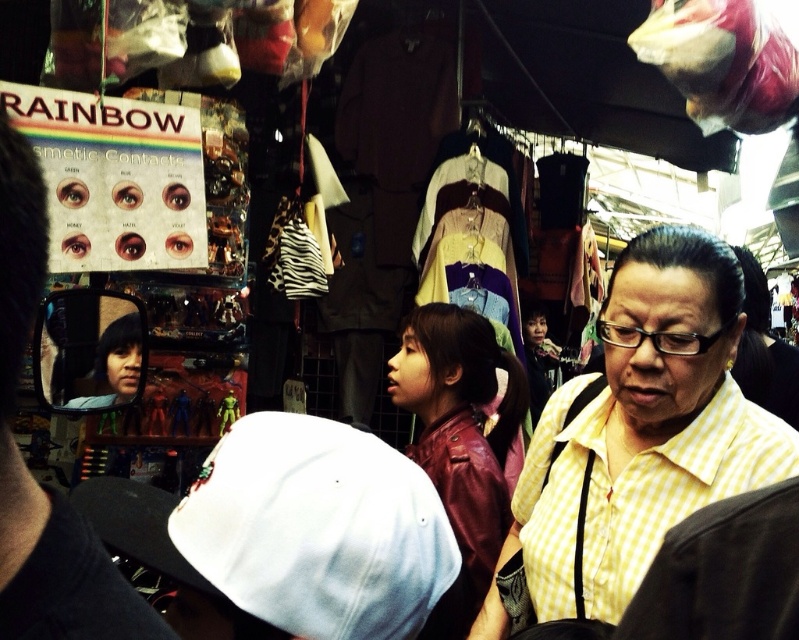
Based on the photo, you are a customer in the market and want to pick up both the yellow checkered shirt at center and the matte black cap at lower left. If you can only carry items within a 1 meter reach, will you be able to pick them up without moving your position?

The yellow checkered shirt at center and the matte black cap at lower left are 1.05 meters apart, which is slightly more than 1 meter. Therefore, you cannot pick them up without moving your position.

You are a customer at the market trying to decide between two items. You see the yellow checkered shirt at center and the matte black cap at lower left. Which item takes up more horizontal space?

The yellow checkered shirt at center might be wider than matte black cap at lower left, so it likely takes up more horizontal space.